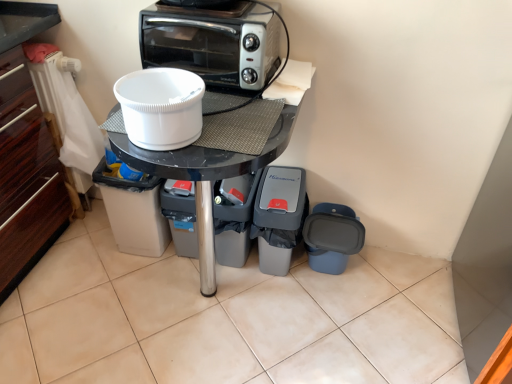
I want to click on white plastic bowl at center, the 2th appliance viewed from the left, so click(x=161, y=107).

The width and height of the screenshot is (512, 384). In order to click on silver metallic toaster oven at upper center in this screenshot , I will do `click(213, 42)`.

The width and height of the screenshot is (512, 384). Describe the element at coordinates (279, 217) in the screenshot. I see `gray plastic trash can at lower center, arranged as the second appliance when viewed from the right` at that location.

Locate an element on the screen. This screenshot has width=512, height=384. blue plastic trash can at lower right, the fifth appliance when ordered from left to right is located at coordinates (332, 237).

Is black glossy table at center wider than blue plastic trash can at lower right, the fifth appliance when ordered from left to right?

Yes, black glossy table at center is wider than blue plastic trash can at lower right, the fifth appliance when ordered from left to right.

Looking at this image, from the image's perspective, is black glossy table at center located above or below blue plastic trash can at lower right, the 1th appliance positioned from the right?

Clearly, from the image's perspective, black glossy table at center is above blue plastic trash can at lower right, the 1th appliance positioned from the right.

Is the position of black glossy table at center less distant than that of blue plastic trash can at lower right, the 1th appliance positioned from the right?

Yes, black glossy table at center is closer to the viewer.

From the image's perspective, is gray plastic trash can at lower center, which is counted as the 3th appliance, starting from the right, over white plastic bowl at center, which is the fourth appliance in right-to-left order?

Actually, gray plastic trash can at lower center, which is counted as the 3th appliance, starting from the right, appears below white plastic bowl at center, which is the fourth appliance in right-to-left order, in the image.

Is the position of gray plastic trash can at lower center, which is the 3th appliance from left to right, less distant than that of white plastic bowl at center, which is the fourth appliance in right-to-left order?

No, gray plastic trash can at lower center, which is the 3th appliance from left to right, is further to the viewer.

Is gray plastic trash can at lower center, which is counted as the 3th appliance, starting from the right, looking in the opposite direction of white plastic bowl at center, the 2th appliance viewed from the left?

gray plastic trash can at lower center, which is counted as the 3th appliance, starting from the right, is not turned away from white plastic bowl at center, the 2th appliance viewed from the left.

Considering the sizes of gray plastic trash can at lower center, which is counted as the 3th appliance, starting from the right, and white plastic bowl at center, the 2th appliance viewed from the left, in the image, is gray plastic trash can at lower center, which is counted as the 3th appliance, starting from the right, taller or shorter than white plastic bowl at center, the 2th appliance viewed from the left,?

gray plastic trash can at lower center, which is counted as the 3th appliance, starting from the right, is taller than white plastic bowl at center, the 2th appliance viewed from the left.

How different are the orientations of white plastic bucket at center, placed as the fifth appliance when sorted from right to left, and silver metallic toaster oven at upper center in degrees?

2.37 degrees separate the facing orientations of white plastic bucket at center, placed as the fifth appliance when sorted from right to left, and silver metallic toaster oven at upper center.

Looking at the image, does white plastic bucket at center, placed as the fifth appliance when sorted from right to left, seem bigger or smaller compared to silver metallic toaster oven at upper center?

Clearly, white plastic bucket at center, placed as the fifth appliance when sorted from right to left, is larger in size than silver metallic toaster oven at upper center.

Is white plastic bucket at center, placed as the fifth appliance when sorted from right to left, directly adjacent to silver metallic toaster oven at upper center?

No, white plastic bucket at center, placed as the fifth appliance when sorted from right to left, is not in contact with silver metallic toaster oven at upper center.

From the image's perspective, is white plastic bucket at center, placed as the fifth appliance when sorted from right to left, above silver metallic toaster oven at upper center?

Incorrect, from the image's perspective, white plastic bucket at center, placed as the fifth appliance when sorted from right to left, is lower than silver metallic toaster oven at upper center.

Could you tell me if gray plastic trash can at lower center, which is counted as the 3th appliance, starting from the right, is facing white plastic bucket at center, the first appliance in the left-to-right sequence?

No.

Between gray plastic trash can at lower center, which is the 3th appliance from left to right, and white plastic bucket at center, placed as the fifth appliance when sorted from right to left, which one appears on the left side from the viewer's perspective?

Positioned to the left is white plastic bucket at center, placed as the fifth appliance when sorted from right to left.

Are gray plastic trash can at lower center, which is counted as the 3th appliance, starting from the right, and white plastic bucket at center, placed as the fifth appliance when sorted from right to left, far apart?

No, there isn't a large distance between gray plastic trash can at lower center, which is counted as the 3th appliance, starting from the right, and white plastic bucket at center, placed as the fifth appliance when sorted from right to left.

Would you say white plastic bowl at center, which is the fourth appliance in right-to-left order, is a long distance from gray plastic trash can at lower center, which is the 3th appliance from left to right?

No.

Considering the relative positions of white plastic bowl at center, the 2th appliance viewed from the left, and gray plastic trash can at lower center, which is the 3th appliance from left to right, in the image provided, is white plastic bowl at center, the 2th appliance viewed from the left, to the left of gray plastic trash can at lower center, which is the 3th appliance from left to right, from the viewer's perspective?

Yes, white plastic bowl at center, the 2th appliance viewed from the left, is to the left of gray plastic trash can at lower center, which is the 3th appliance from left to right.

Does white plastic bowl at center, which is the fourth appliance in right-to-left order, have a lesser height compared to gray plastic trash can at lower center, which is the 3th appliance from left to right?

Correct, white plastic bowl at center, which is the fourth appliance in right-to-left order, is not as tall as gray plastic trash can at lower center, which is the 3th appliance from left to right.

From the image's perspective, which one is positioned higher, white plastic bowl at center, the 2th appliance viewed from the left, or gray plastic trash can at lower center, which is the 3th appliance from left to right?

white plastic bowl at center, the 2th appliance viewed from the left, is shown above in the image.

Considering the positions of points (228, 235) and (209, 196), is point (228, 235) closer to camera compared to point (209, 196)?

No.

Which of these two, gray plastic trash can at lower center, which is the 3th appliance from left to right, or black glossy table at center, is thinner?

With smaller width is gray plastic trash can at lower center, which is the 3th appliance from left to right.

Is gray plastic trash can at lower center, which is the 3th appliance from left to right, to the right of black glossy table at center from the viewer's perspective?

Yes.

Is black glossy table at center in front of or behind white plastic bowl at center, the 2th appliance viewed from the left, in the image?

In the image, black glossy table at center appears behind white plastic bowl at center, the 2th appliance viewed from the left.

Who is shorter, black glossy table at center or white plastic bowl at center, the 2th appliance viewed from the left?

white plastic bowl at center, the 2th appliance viewed from the left.

Between point (239, 159) and point (149, 100), which one is positioned behind?

The point (149, 100) is behind.

Choose the correct answer: Is black glossy table at center inside white plastic bowl at center, the 2th appliance viewed from the left, or outside it?

black glossy table at center lies outside white plastic bowl at center, the 2th appliance viewed from the left.

I want to click on table on the left of the blue plastic trash can at lower right, the 1th appliance positioned from the right, so click(206, 176).

Identify the location of appliance that is the 1st one when counting rightward from the white plastic bowl at center, which is the fourth appliance in right-to-left order. (236, 233).

Based on their spatial positions, is gray plastic trash can at lower center, which is the 3th appliance from left to right, or black glossy table at center closer to blue plastic trash can at lower right, the 1th appliance positioned from the right?

gray plastic trash can at lower center, which is the 3th appliance from left to right.

Based on their spatial positions, is white plastic bucket at center, the first appliance in the left-to-right sequence, or blue plastic trash can at lower right, the fifth appliance when ordered from left to right, closer to black glossy table at center?

white plastic bucket at center, the first appliance in the left-to-right sequence.

Looking at the image, which one is located closer to black glossy table at center, white plastic bowl at center, which is the fourth appliance in right-to-left order, or blue plastic trash can at lower right, the fifth appliance when ordered from left to right?

white plastic bowl at center, which is the fourth appliance in right-to-left order, lies closer to black glossy table at center than the other object.

Considering their positions, is gray plastic trash can at lower center, the 4th appliance viewed from the left, positioned closer to black glossy table at center than white plastic bucket at center, the first appliance in the left-to-right sequence?

gray plastic trash can at lower center, the 4th appliance viewed from the left, lies closer to black glossy table at center than the other object.

Based on their spatial positions, is gray plastic trash can at lower center, arranged as the second appliance when viewed from the right, or blue plastic trash can at lower right, the fifth appliance when ordered from left to right, further from gray plastic trash can at lower center, which is the 3th appliance from left to right?

blue plastic trash can at lower right, the fifth appliance when ordered from left to right.

Which object lies nearer to the anchor point white plastic bowl at center, the 2th appliance viewed from the left, silver metallic toaster oven at upper center or black glossy table at center?

black glossy table at center.

Based on the photo, based on their spatial positions, is white plastic bucket at center, the first appliance in the left-to-right sequence, or gray plastic trash can at lower center, which is the 3th appliance from left to right, further from white plastic bowl at center, which is the fourth appliance in right-to-left order?

white plastic bucket at center, the first appliance in the left-to-right sequence.

Based on their spatial positions, is gray plastic trash can at lower center, which is counted as the 3th appliance, starting from the right, or gray plastic trash can at lower center, the 4th appliance viewed from the left, closer to blue plastic trash can at lower right, the 1th appliance positioned from the right?

Among the two, gray plastic trash can at lower center, the 4th appliance viewed from the left, is located nearer to blue plastic trash can at lower right, the 1th appliance positioned from the right.

Identify the location of table between silver metallic toaster oven at upper center and gray plastic trash can at lower center, which is counted as the 3th appliance, starting from the right, from top to bottom. This screenshot has width=512, height=384. 206,176.

At what (x,y) coordinates should I click in order to perform the action: click on appliance between gray plastic trash can at lower center, which is counted as the 3th appliance, starting from the right, and blue plastic trash can at lower right, the fifth appliance when ordered from left to right, in the horizontal direction. Please return your answer as a coordinate pair (x, y). The image size is (512, 384). Looking at the image, I should click on (x=279, y=217).

The width and height of the screenshot is (512, 384). I want to click on table positioned between white plastic bowl at center, which is the fourth appliance in right-to-left order, and gray plastic trash can at lower center, which is counted as the 3th appliance, starting from the right, from near to far, so click(x=206, y=176).

I want to click on kitchen appliance between white plastic bowl at center, the 2th appliance viewed from the left, and gray plastic trash can at lower center, which is counted as the 3th appliance, starting from the right, from front to back, so click(x=213, y=42).